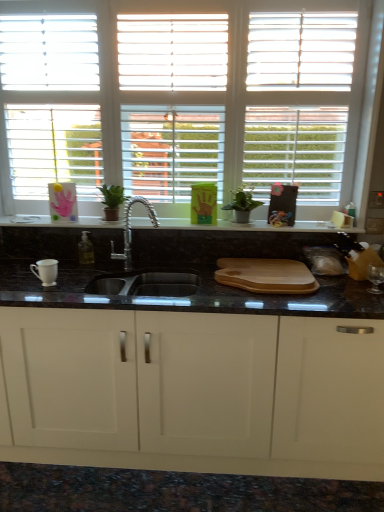
Where is `free space above black granite cutting board at center (from a real-world perspective)`? The width and height of the screenshot is (384, 512). free space above black granite cutting board at center (from a real-world perspective) is located at coordinates [176, 219].